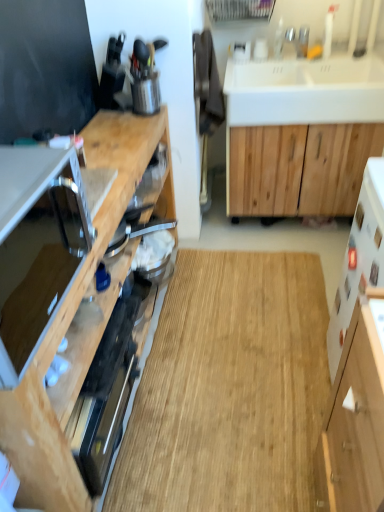
Where is `vacant space underneath natural wood floor at center (from a real-world perspective)`? Image resolution: width=384 pixels, height=512 pixels. vacant space underneath natural wood floor at center (from a real-world perspective) is located at coordinates (248, 364).